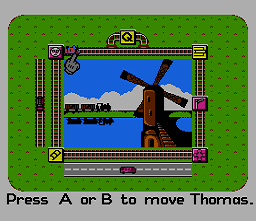
The height and width of the screenshot is (221, 256). I want to click on corner rails, so [x=110, y=36], [x=142, y=38].